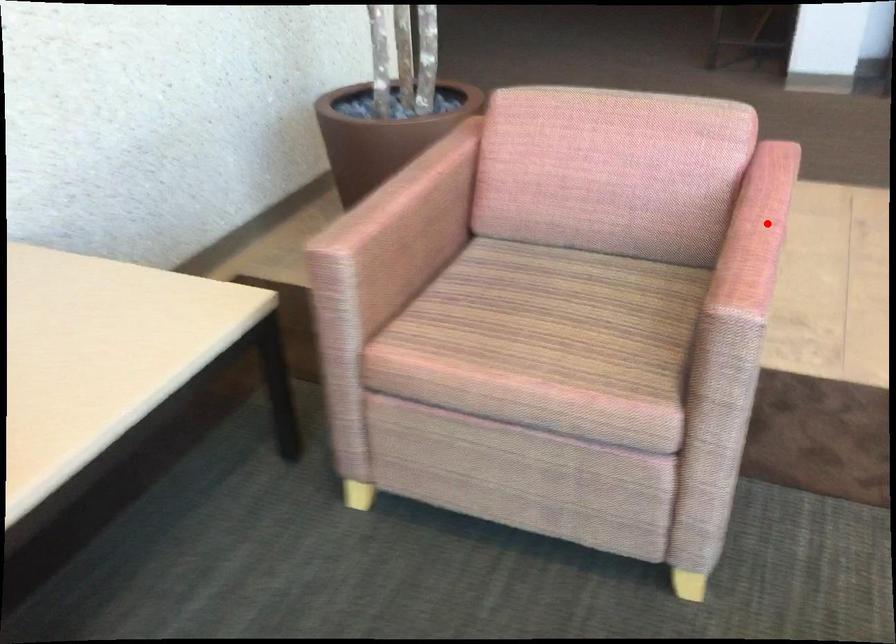
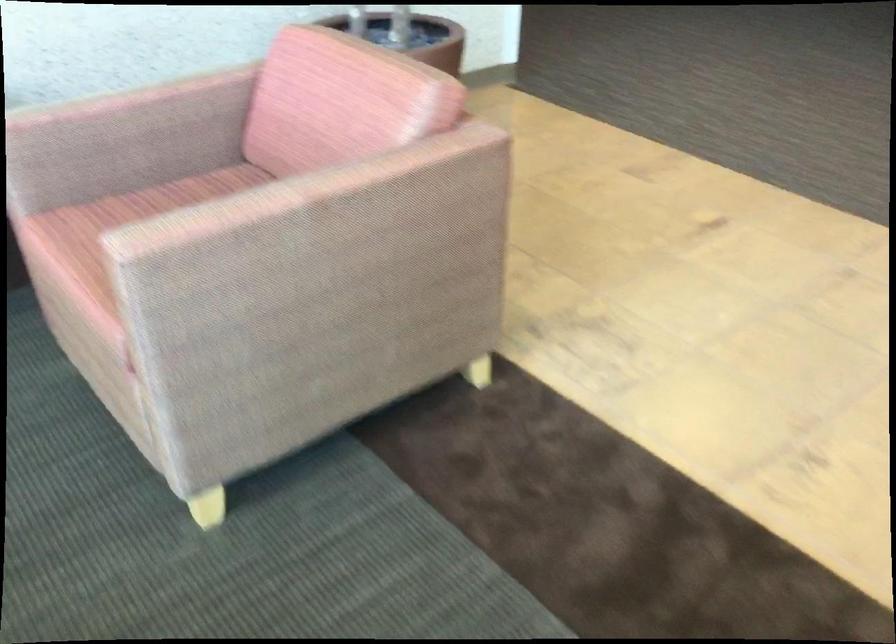
Find the pixel in the second image that matches the highlighted location in the first image.

(298, 192)